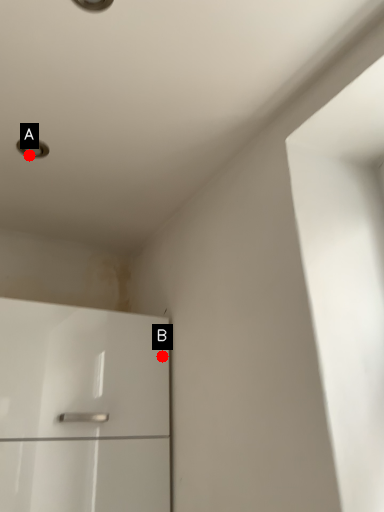
Question: Two points are circled on the image, labeled by A and B beside each circle. Which point is closer to the camera taking this photo?

Choices:
 (A) A is closer
 (B) B is closer

Answer: (A)